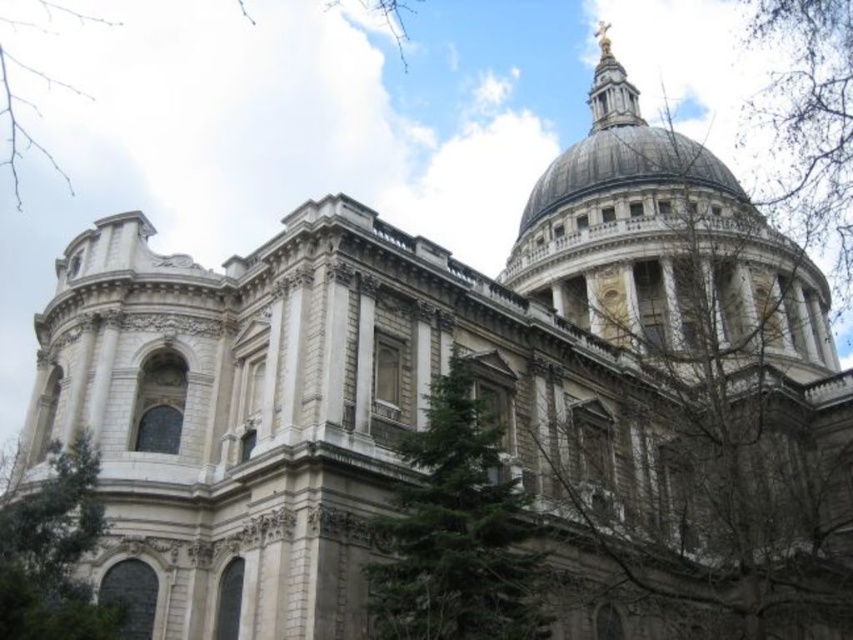
Who is positioned more to the right, green textured tree at center or green leafy tree at lower left?

From the viewer's perspective, green textured tree at center appears more on the right side.

Which is in front, point (451, 449) or point (97, 515)?

Positioned in front is point (451, 449).

The image size is (853, 640). In order to click on green textured tree at center in this screenshot , I will do `click(456, 531)`.

Which of these two, bare branches at upper right or green leafy tree at upper center, stands shorter?

Standing shorter between the two is green leafy tree at upper center.

Does point (808, 227) lie behind point (57, 4)?

No, it is in front of (57, 4).

The width and height of the screenshot is (853, 640). What are the coordinates of `bare branches at upper right` in the screenshot? It's located at (809, 124).

Which of these two, green leafy tree at lower left or green leafy tree at upper center, stands taller?

Standing taller between the two is green leafy tree at upper center.

Find the location of a particular element. The height and width of the screenshot is (640, 853). green leafy tree at lower left is located at coordinates pyautogui.click(x=54, y=554).